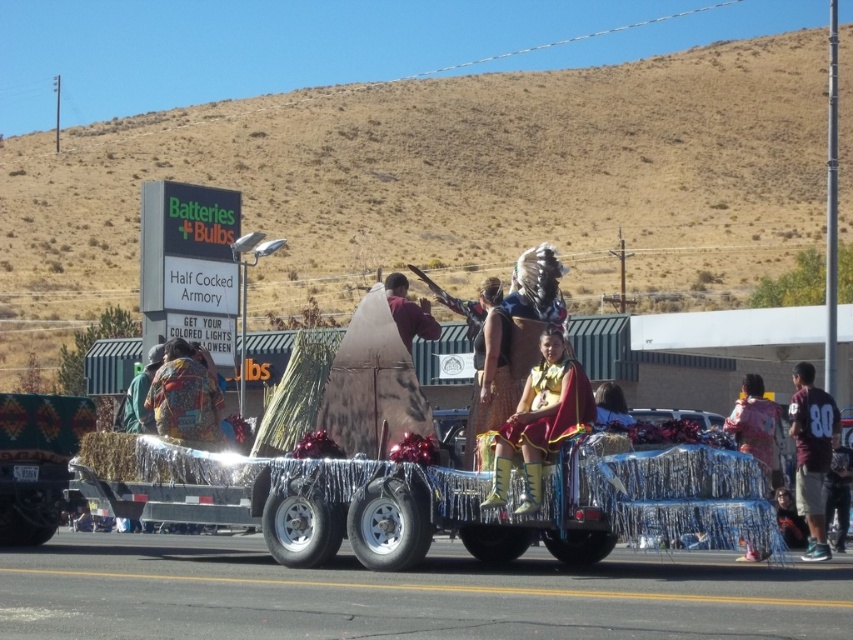
Question: Which point is farther from the camera taking this photo?

Choices:
 (A) (428, 339)
 (B) (141, 419)
 (C) (735, 413)
 (D) (821, 552)

Answer: (A)

Question: Which point appears closest to the camera in this image?

Choices:
 (A) (762, 458)
 (B) (148, 400)
 (C) (601, 403)

Answer: (C)

Question: Is printed fabric backpack at left to the right of maroon jersey at right from the viewer's perspective?

Choices:
 (A) no
 (B) yes

Answer: (A)

Question: Does yellow leather boots at center have a larger size compared to maroon jersey at right?

Choices:
 (A) yes
 (B) no

Answer: (B)

Question: Observing the image, what is the correct spatial positioning of printed fabric backpack at left in reference to pink fabric at center?

Choices:
 (A) below
 (B) above

Answer: (B)

Question: Which point is farther to the camera?

Choices:
 (A) (573, 412)
 (B) (590, 472)
 (C) (206, 433)

Answer: (C)